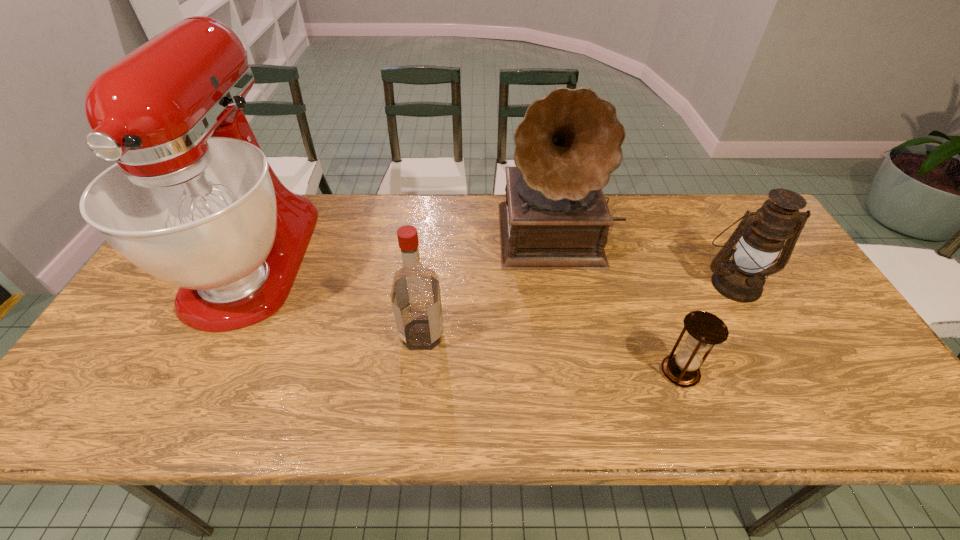
Locate an element on the screen. The width and height of the screenshot is (960, 540). the tallest object is located at coordinates (192, 200).

At what (x,y) coordinates should I click in order to perform the action: click on the leftmost object. Please return your answer as a coordinate pair (x, y). The width and height of the screenshot is (960, 540). Looking at the image, I should click on click(192, 200).

At what (x,y) coordinates should I click in order to perform the action: click on record player. Please return your answer as a coordinate pair (x, y). The height and width of the screenshot is (540, 960). Looking at the image, I should click on 555,217.

This screenshot has width=960, height=540. What are the coordinates of `liquor` in the screenshot? It's located at (415, 295).

The height and width of the screenshot is (540, 960). Identify the location of oil lamp. (761, 234).

Locate an element on the screen. The image size is (960, 540). the shortest object is located at coordinates point(705,330).

You are a GUI agent. You are given a task and a screenshot of the screen. Output one action in this format:
    pyautogui.click(x=<x>, y=<y>)
    Task: Click on the nearest object
    The width and height of the screenshot is (960, 540).
    Given the screenshot: What is the action you would take?
    pyautogui.click(x=705, y=330)

The height and width of the screenshot is (540, 960). I want to click on vacant region located 0.100m at the attachment hub of the tallest object, so click(x=192, y=378).

I want to click on free spot located from the horn of the record player, so click(573, 296).

The height and width of the screenshot is (540, 960). I want to click on vacant space situated on the front-facing side of the liquor, so click(x=479, y=334).